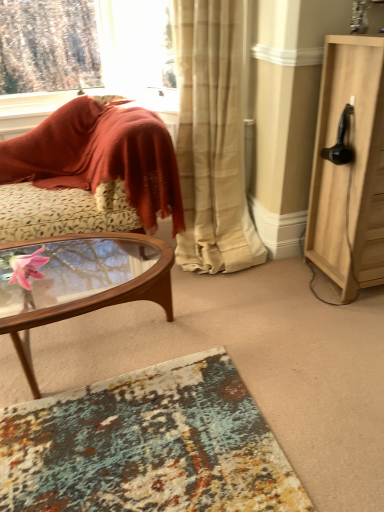
What do you see at coordinates (212, 139) in the screenshot?
I see `beige sheer curtain at center` at bounding box center [212, 139].

Find the location of a particular element. This screenshot has width=384, height=512. velvet-like rust-colored cushion at left is located at coordinates (101, 156).

Where is `light wood cabinet at right`? The height and width of the screenshot is (512, 384). light wood cabinet at right is located at coordinates (349, 167).

In order to click on beige sheer curtain at center in this screenshot , I will do `click(212, 139)`.

Looking at this image, does beige sheer curtain at center touch velvet-like rust-colored cushion at left?

No, beige sheer curtain at center is not beside velvet-like rust-colored cushion at left.

Does beige sheer curtain at center turn towards velvet-like rust-colored cushion at left?

No.

Which is closer, (229, 74) or (137, 192)?

Point (229, 74) appears to be closer to the viewer than point (137, 192).

Would you say textured rug at lower center contains woodenwoodencoffee table at left?

No, woodenwoodencoffee table at left is not a part of textured rug at lower center.

Image resolution: width=384 pixels, height=512 pixels. I want to click on desk in front of the woodenwoodencoffee table at left, so click(x=148, y=446).

Considering the sizes of textured rug at lower center and woodenwoodencoffee table at left in the image, is textured rug at lower center bigger or smaller than woodenwoodencoffee table at left?

In the image, textured rug at lower center appears to be smaller than woodenwoodencoffee table at left.

Is textured rug at lower center facing towards woodenwoodencoffee table at left?

No, textured rug at lower center is not turned towards woodenwoodencoffee table at left.

Considering the relative sizes of light wood cabinet at right and velvet-like rust-colored cushion at left in the image provided, is light wood cabinet at right bigger than velvet-like rust-colored cushion at left?

No.

From the picture: Considering the positions of objects light wood cabinet at right and velvet-like rust-colored cushion at left in the image provided, who is more to the left, light wood cabinet at right or velvet-like rust-colored cushion at left?

velvet-like rust-colored cushion at left is more to the left.

In order to click on cushion behind the light wood cabinet at right in this screenshot , I will do `click(101, 156)`.

Are light wood cabinet at right and velvet-like rust-colored cushion at left making contact?

No, light wood cabinet at right is not beside velvet-like rust-colored cushion at left.

The height and width of the screenshot is (512, 384). Find the location of `curtain above the woodenwoodencoffee table at left (from the image's perspective)`. curtain above the woodenwoodencoffee table at left (from the image's perspective) is located at coordinates pos(212,139).

Does point (186, 22) come behind point (67, 294)?

No.

What's the angular difference between beige sheer curtain at center and woodenwoodencoffee table at left's facing directions?

The facing directions of beige sheer curtain at center and woodenwoodencoffee table at left are 3.05 degrees apart.

Looking at their sizes, would you say beige sheer curtain at center is wider or thinner than woodenwoodencoffee table at left?

beige sheer curtain at center is wider than woodenwoodencoffee table at left.

Between light wood cabinet at right and woodenwoodencoffee table at left, which one has smaller width?

With smaller width is light wood cabinet at right.

Is light wood cabinet at right completely or partially outside of woodenwoodencoffee table at left?

Indeed, light wood cabinet at right is completely outside woodenwoodencoffee table at left.

In terms of size, does light wood cabinet at right appear bigger or smaller than woodenwoodencoffee table at left?

light wood cabinet at right is bigger than woodenwoodencoffee table at left.

How far apart are light wood cabinet at right and woodenwoodencoffee table at left?

light wood cabinet at right and woodenwoodencoffee table at left are 1.08 meters apart.

Is light wood cabinet at right smaller than beige sheer curtain at center?

Yes.

Considering the relative positions of light wood cabinet at right and beige sheer curtain at center in the image provided, is light wood cabinet at right in front of beige sheer curtain at center?

Yes, light wood cabinet at right is in front of beige sheer curtain at center.

Between point (326, 167) and point (263, 249), which one is positioned behind?

The point (263, 249) is behind.

How different are the orientations of light wood cabinet at right and beige sheer curtain at center in degrees?

There is a 1.71-degree angle between the facing directions of light wood cabinet at right and beige sheer curtain at center.

From a real-world perspective, is woodenwoodencoffee table at left below light wood cabinet at right?

Correct, in the physical world, woodenwoodencoffee table at left is lower than light wood cabinet at right.

Considering their positions, is woodenwoodencoffee table at left located in front of or behind light wood cabinet at right?

Clearly, woodenwoodencoffee table at left is in front of light wood cabinet at right.

From the image's perspective, which one is positioned higher, woodenwoodencoffee table at left or light wood cabinet at right?

light wood cabinet at right, from the image's perspective.

I want to click on cushion located underneath the beige sheer curtain at center (from a real-world perspective), so click(101, 156).

What are the coordinates of `coffee table above the textured rug at lower center (from the image's perspective)` in the screenshot? It's located at (82, 283).

Estimate the real-world distances between objects in this image. Which object is further from woodenwoodencoffee table at left, velvet-like rust-colored cushion at left or textured rug at lower center?

Based on the image, textured rug at lower center appears to be further to woodenwoodencoffee table at left.

Looking at the image, which one is located closer to textured rug at lower center, beige sheer curtain at center or velvet-like rust-colored cushion at left?

beige sheer curtain at center lies closer to textured rug at lower center than the other object.

Which object lies nearer to the anchor point textured rug at lower center, light wood cabinet at right or beige sheer curtain at center?

beige sheer curtain at center.

Based on their spatial positions, is textured rug at lower center or beige sheer curtain at center further from light wood cabinet at right?

textured rug at lower center.

Estimate the real-world distances between objects in this image. Which object is closer to light wood cabinet at right, woodenwoodencoffee table at left or textured rug at lower center?

woodenwoodencoffee table at left is closer to light wood cabinet at right.

Considering their positions, is textured rug at lower center positioned closer to beige sheer curtain at center than woodenwoodencoffee table at left?

Based on the image, woodenwoodencoffee table at left appears to be nearer to beige sheer curtain at center.

When comparing their distances from beige sheer curtain at center, does textured rug at lower center or light wood cabinet at right seem further?

Based on the image, textured rug at lower center appears to be further to beige sheer curtain at center.

Based on their spatial positions, is beige sheer curtain at center or textured rug at lower center further from velvet-like rust-colored cushion at left?

The object further to velvet-like rust-colored cushion at left is textured rug at lower center.

Locate an element on the screen. coffee table situated between velvet-like rust-colored cushion at left and light wood cabinet at right from left to right is located at coordinates (82, 283).

Identify the location of cushion that lies between beige sheer curtain at center and woodenwoodencoffee table at left from top to bottom. The image size is (384, 512). (101, 156).

Where is `cabinetry between beige sheer curtain at center and textured rug at lower center from top to bottom`? cabinetry between beige sheer curtain at center and textured rug at lower center from top to bottom is located at coordinates (349, 167).

At what (x,y) coordinates should I click in order to perform the action: click on desk situated between woodenwoodencoffee table at left and light wood cabinet at right from left to right. Please return your answer as a coordinate pair (x, y). Looking at the image, I should click on (148, 446).